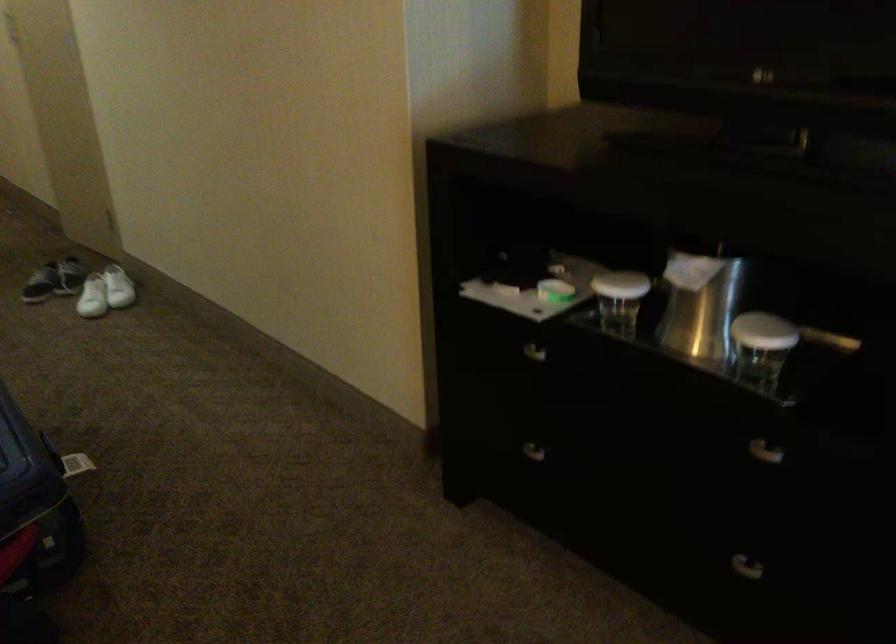
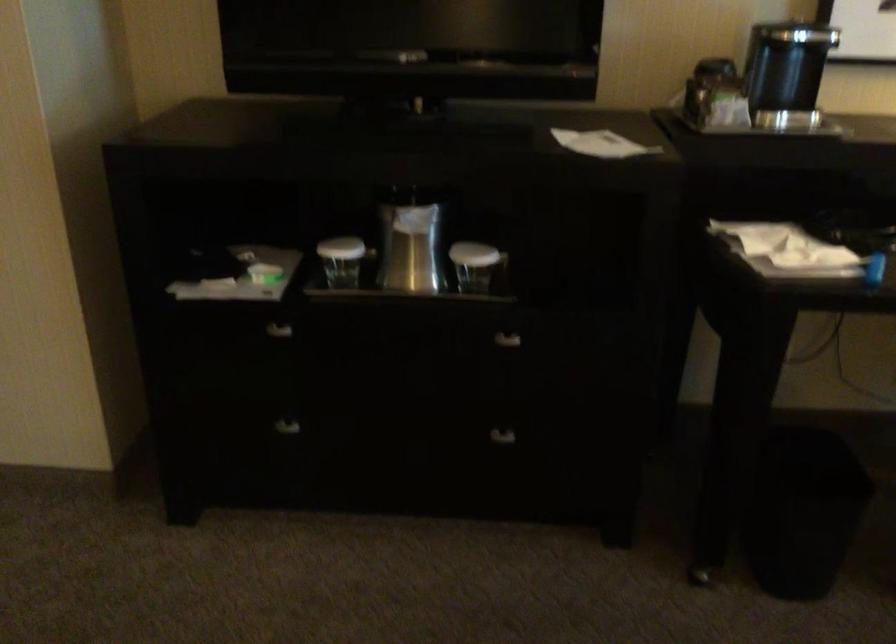
The point at (776, 346) is marked in the first image. Where is the corresponding point in the second image?

(479, 268)